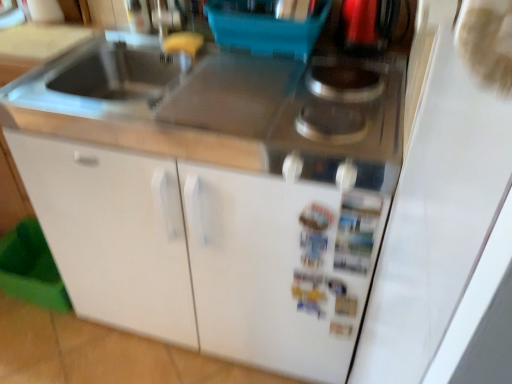
Locate an element on the screen. Image resolution: width=512 pixels, height=384 pixels. free spot above white matte cabinet at center, which is the 1th cabinetry in right-to-left order (from a real-world perspective) is located at coordinates (293, 74).